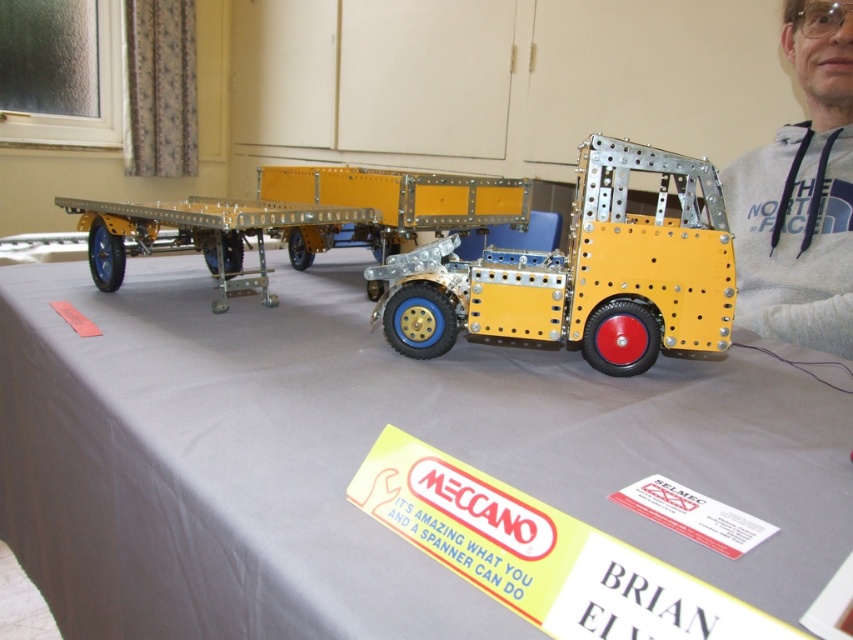
Question: Does yellow metallic truck at center appear over gray fleece hoodie at upper right?

Choices:
 (A) yes
 (B) no

Answer: (B)

Question: Does yellow metallic truck at center come behind gray fleece hoodie at upper right?

Choices:
 (A) yes
 (B) no

Answer: (B)

Question: Is gray fleece hoodie at upper right closer to the viewer compared to metallic yellow trailer truck at center?

Choices:
 (A) no
 (B) yes

Answer: (A)

Question: Which of the following is the farthest from the observer?

Choices:
 (A) yellow metallic truck at center
 (B) metallic yellow trailer truck at center
 (C) gray fleece hoodie at upper right
 (D) gray fabric at center

Answer: (C)

Question: Which of the following is the farthest from the observer?

Choices:
 (A) gray fabric at center
 (B) yellow metallic truck at center
 (C) metallic yellow trailer truck at center
 (D) gray fleece hoodie at upper right

Answer: (D)

Question: Based on their relative distances, which object is nearer to the yellow metallic truck at center?

Choices:
 (A) gray fleece hoodie at upper right
 (B) gray fabric at center

Answer: (B)